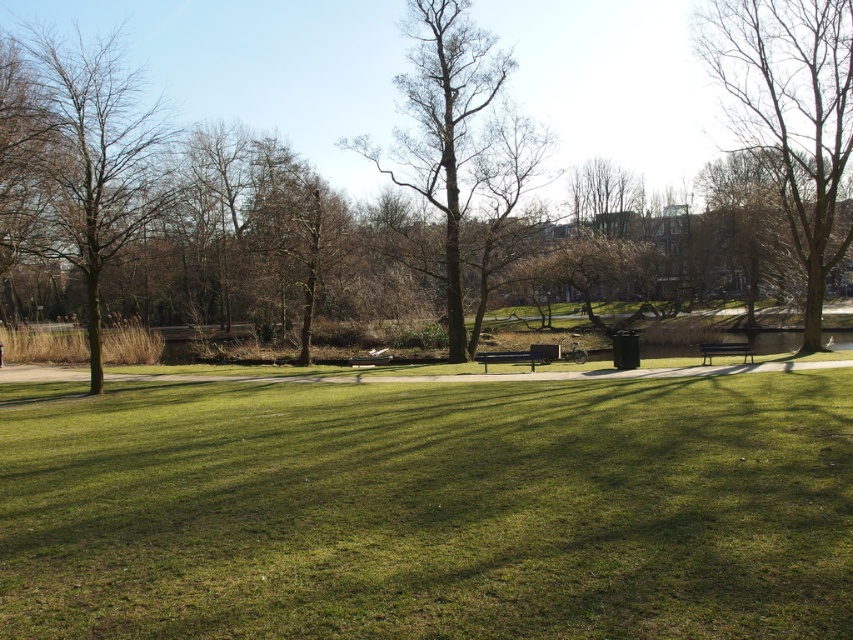
Which is more to the left, green grassy field at center or metallic silver bench at center?

Positioned to the left is green grassy field at center.

The width and height of the screenshot is (853, 640). What do you see at coordinates (430, 509) in the screenshot?
I see `green grassy field at center` at bounding box center [430, 509].

Find the location of `green grassy field at center`. green grassy field at center is located at coordinates (430, 509).

Can you confirm if brown leafless tree at center is smaller than wooden bench at right?

Actually, brown leafless tree at center might be larger than wooden bench at right.

Is brown leafless tree at center above wooden bench at right?

Yes, brown leafless tree at center is above wooden bench at right.

Is point (300, 116) less distant than point (735, 353)?

No, it is behind (735, 353).

Where is `brown leafless tree at center`? brown leafless tree at center is located at coordinates (260, 65).

Is bare wood tree at center wider than brown textured tree at left?

Incorrect, bare wood tree at center's width does not surpass brown textured tree at left's.

Can you confirm if bare wood tree at center is positioned above brown textured tree at left?

Yes, bare wood tree at center is above brown textured tree at left.

Find the location of a particular element. The height and width of the screenshot is (640, 853). bare wood tree at center is located at coordinates (457, 141).